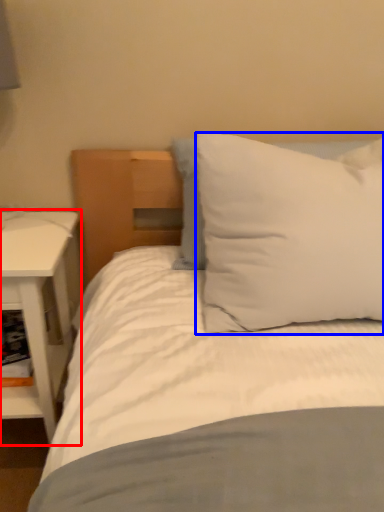
Question: Which point is closer to the camera, nightstand (highlighted by a red box) or pillow (highlighted by a blue box)?

Choices:
 (A) nightstand
 (B) pillow

Answer: (B)